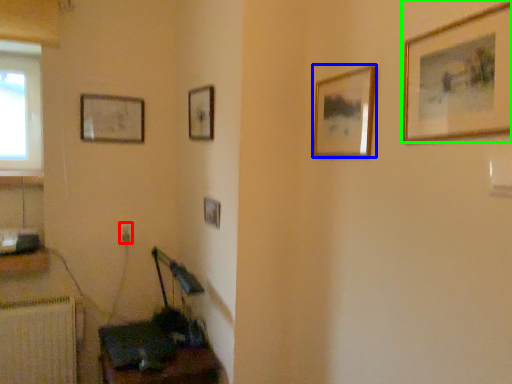
Question: Based on their relative distances, which object is farther from electric outlet (highlighted by a red box)? Choose from picture frame (highlighted by a blue box) and picture frame (highlighted by a green box).

Choices:
 (A) picture frame
 (B) picture frame

Answer: (B)